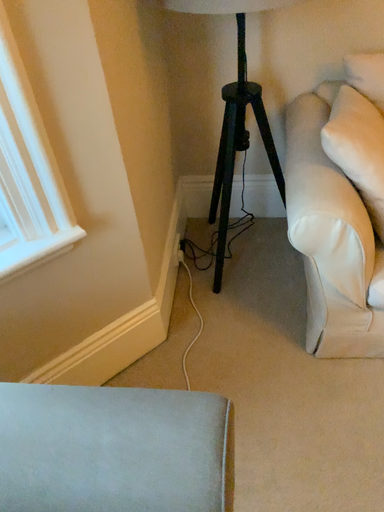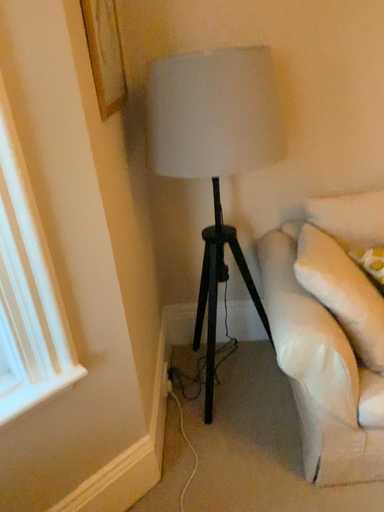
Question: Which way did the camera rotate in the video?

Choices:
 (A) rotated upward
 (B) rotated downward

Answer: (A)